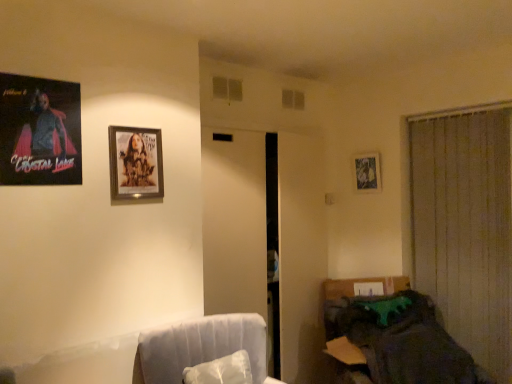
Question: From a real-world perspective, is metallic silver picture frame at upper right, which is the third picture frame from front to back, below matte black poster at upper left, which is counted as the first picture frame, starting from the front?

Choices:
 (A) no
 (B) yes

Answer: (B)

Question: Does metallic silver picture frame at upper right, the 3th picture frame positioned from the left, appear on the right side of matte black poster at upper left, which is the 3th picture frame in right-to-left order?

Choices:
 (A) no
 (B) yes

Answer: (B)

Question: Could you tell me if metallic silver picture frame at upper right, the 1th picture frame when ordered from back to front, is facing matte black poster at upper left, marked as the 3th picture frame in a back-to-front arrangement?

Choices:
 (A) no
 (B) yes

Answer: (B)

Question: Is metallic silver picture frame at upper right, which is the third picture frame from front to back, surrounding matte black poster at upper left, marked as the 3th picture frame in a back-to-front arrangement?

Choices:
 (A) no
 (B) yes

Answer: (A)

Question: Considering the relative sizes of metallic silver picture frame at upper right, the 1th picture frame viewed from the right, and matte black poster at upper left, which is counted as the first picture frame, starting from the front, in the image provided, is metallic silver picture frame at upper right, the 1th picture frame viewed from the right, smaller than matte black poster at upper left, which is counted as the first picture frame, starting from the front,?

Choices:
 (A) no
 (B) yes

Answer: (B)

Question: Looking at their shapes, would you say dark fabric couch at lower right is wider or thinner than matte black poster at upper left, marked as the 3th picture frame in a back-to-front arrangement?

Choices:
 (A) wide
 (B) thin

Answer: (A)

Question: Is point (439, 382) positioned closer to the camera than point (31, 130)?

Choices:
 (A) farther
 (B) closer

Answer: (A)

Question: Considering the positions of dark fabric couch at lower right and matte black poster at upper left, arranged as the first picture frame when viewed from the left, in the image, is dark fabric couch at lower right bigger or smaller than matte black poster at upper left, arranged as the first picture frame when viewed from the left,?

Choices:
 (A) big
 (B) small

Answer: (A)

Question: From the image's perspective, relative to matte black poster at upper left, which is counted as the first picture frame, starting from the front, is dark fabric couch at lower right above or below?

Choices:
 (A) below
 (B) above

Answer: (A)

Question: In the image, is metallic silver picture frame at upper right, the 1th picture frame viewed from the right, positioned in front of or behind beige fabric curtain at right?

Choices:
 (A) behind
 (B) front

Answer: (A)

Question: Considering the positions of point (375, 167) and point (478, 274), is point (375, 167) closer or farther from the camera than point (478, 274)?

Choices:
 (A) farther
 (B) closer

Answer: (A)

Question: From a real-world perspective, relative to beige fabric curtain at right, is metallic silver picture frame at upper right, the 1th picture frame when ordered from back to front, vertically above or below?

Choices:
 (A) below
 (B) above

Answer: (B)

Question: Considering the positions of metallic silver picture frame at upper right, which is the third picture frame from front to back, and beige fabric curtain at right in the image, is metallic silver picture frame at upper right, which is the third picture frame from front to back, taller or shorter than beige fabric curtain at right?

Choices:
 (A) tall
 (B) short

Answer: (B)

Question: In the image, is matte black poster at upper left, arranged as the first picture frame when viewed from the left, positioned in front of or behind white fabric swivel chair at lower left?

Choices:
 (A) front
 (B) behind

Answer: (B)

Question: From a real-world perspective, is matte black poster at upper left, arranged as the first picture frame when viewed from the left, above or below white fabric swivel chair at lower left?

Choices:
 (A) above
 (B) below

Answer: (A)